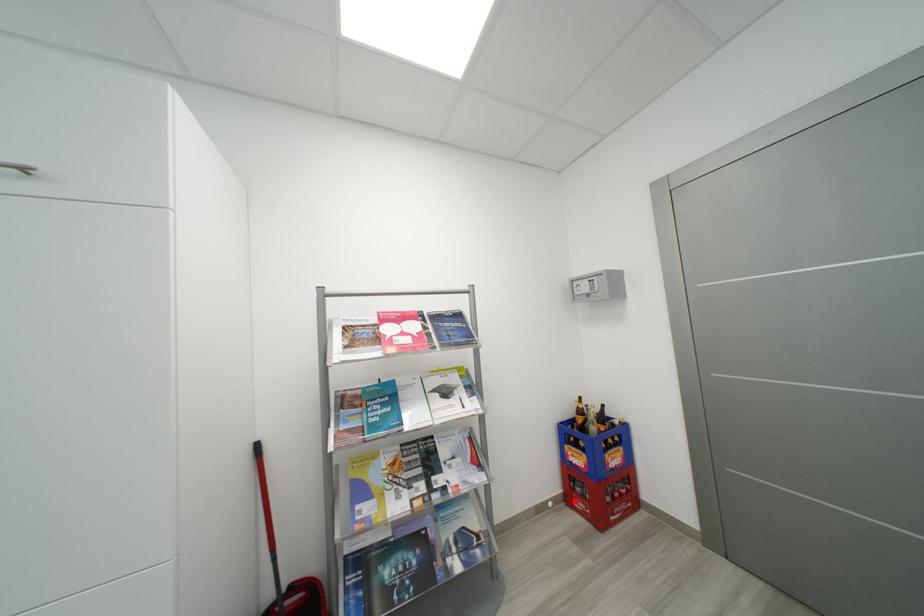
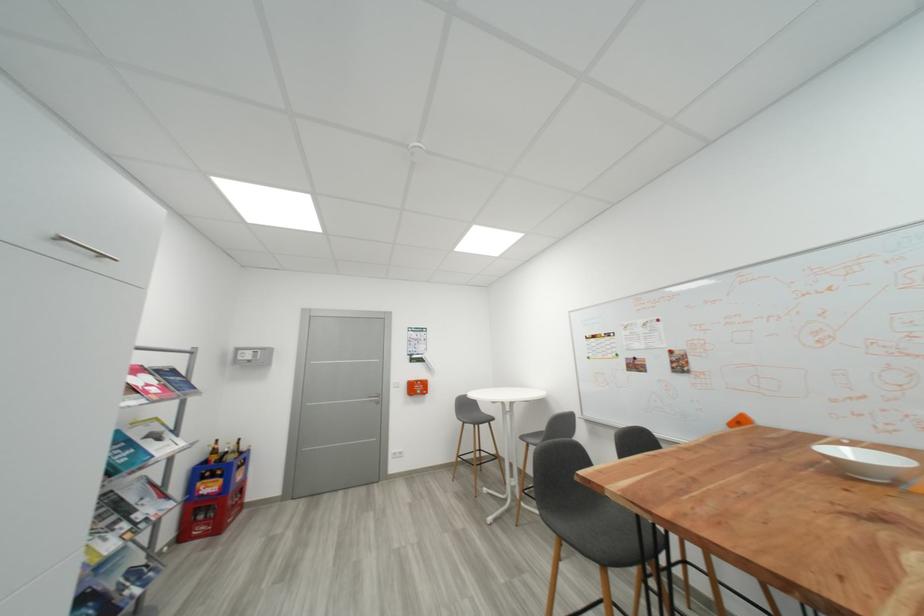
Question: I am providing you with two images of the same scene from different viewpoints. Image1 has a red point marked. In image2, the corresponding 3D location appears at what relative position? Reply with the corresponding letter.

Choices:
 (A) Closer
 (B) Farther

Answer: (B)